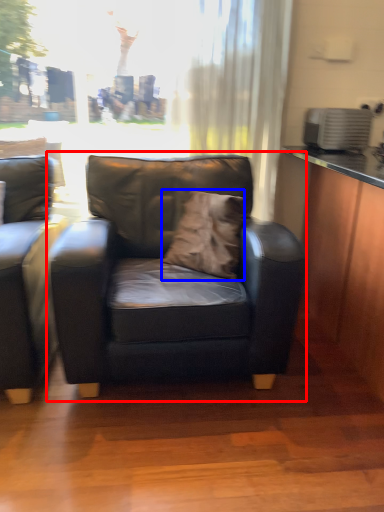
Question: Which point is further to the camera, chair (highlighted by a red box) or pillow (highlighted by a blue box)?

Choices:
 (A) chair
 (B) pillow

Answer: (B)